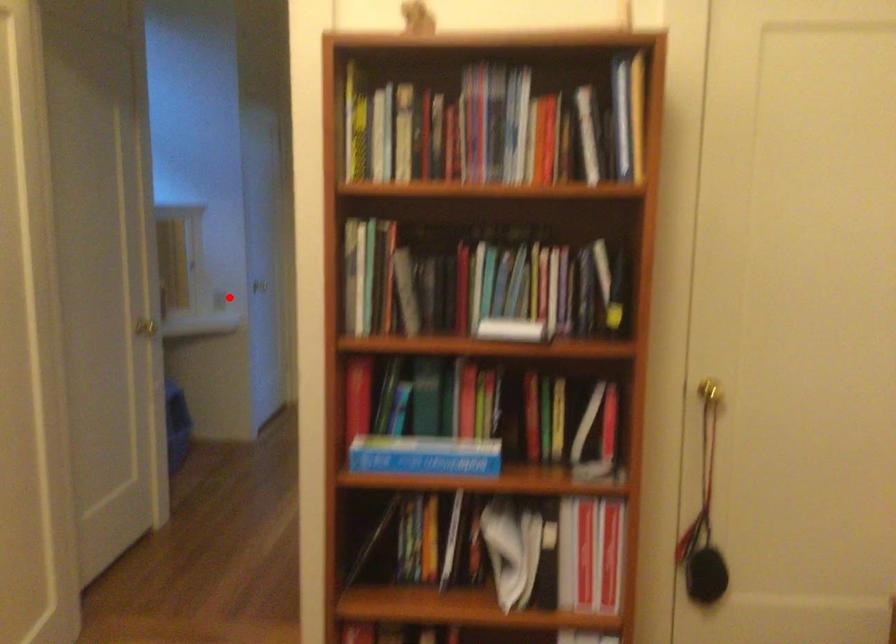
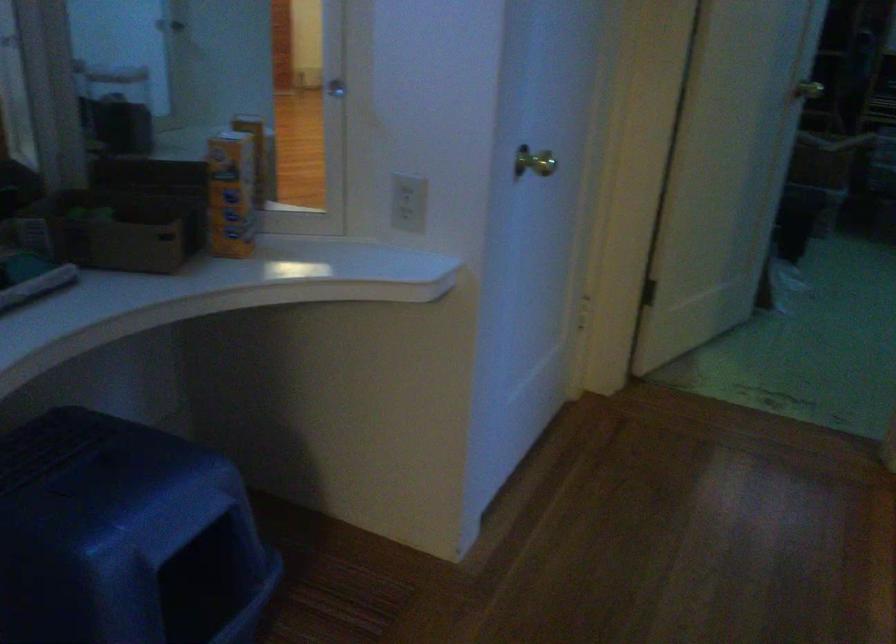
Where in the second image is the point corresponding to the highlighted location from the first image?

(409, 202)